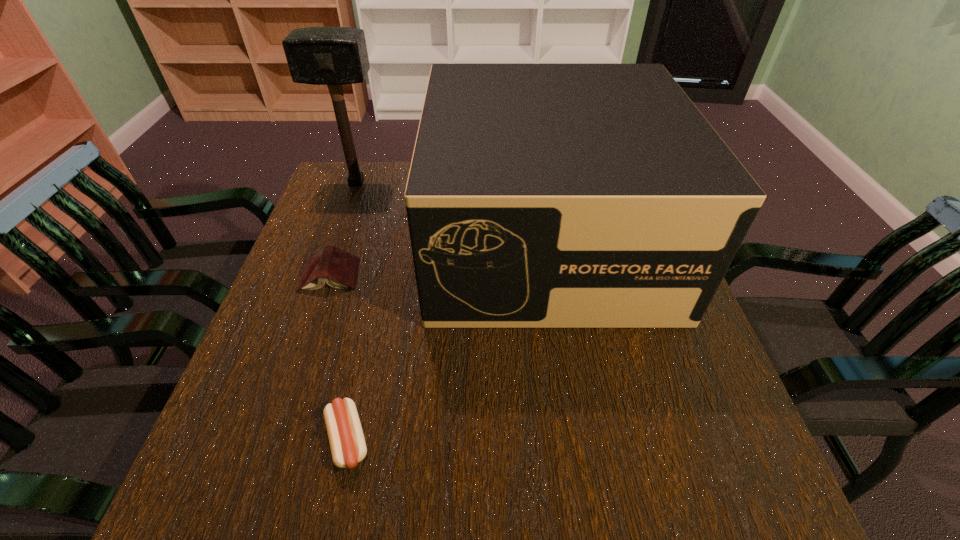
This screenshot has width=960, height=540. Find the location of `mallet present at the far edge`. mallet present at the far edge is located at coordinates (334, 56).

This screenshot has width=960, height=540. In order to click on box located at the far edge in this screenshot , I will do `click(539, 195)`.

You are a GUI agent. You are given a task and a screenshot of the screen. Output one action in this format:
    pyautogui.click(x=<x>, y=<y>)
    Task: Click on the object that is at the near edge
    Image resolution: width=960 pixels, height=540 pixels.
    Given the screenshot: What is the action you would take?
    pyautogui.click(x=347, y=443)

This screenshot has height=540, width=960. I want to click on mallet at the left edge, so click(334, 56).

Find the location of a particular element. book located at the left edge is located at coordinates (338, 268).

Identify the location of object located at the right edge. (539, 195).

Image resolution: width=960 pixels, height=540 pixels. What are the coordinates of `object that is at the far left corner` in the screenshot? It's located at (334, 56).

Image resolution: width=960 pixels, height=540 pixels. I want to click on object present at the far right corner, so click(x=539, y=195).

Find the location of a particular element. vacant space at the near edge is located at coordinates (500, 468).

This screenshot has height=540, width=960. In the image, there is a desktop. What are the coordinates of `free space at the left edge` in the screenshot? It's located at (316, 378).